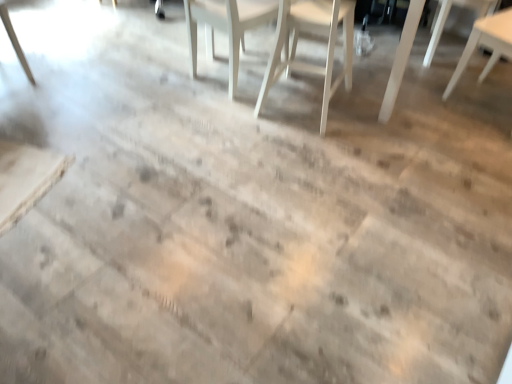
At what (x,y) coordinates should I click in order to perform the action: click on vacant area that is situated to the right of white wood chair at center, the 3th chair in the right-to-left sequence. Please return your answer as a coordinate pair (x, y). This screenshot has width=512, height=384. Looking at the image, I should click on (378, 110).